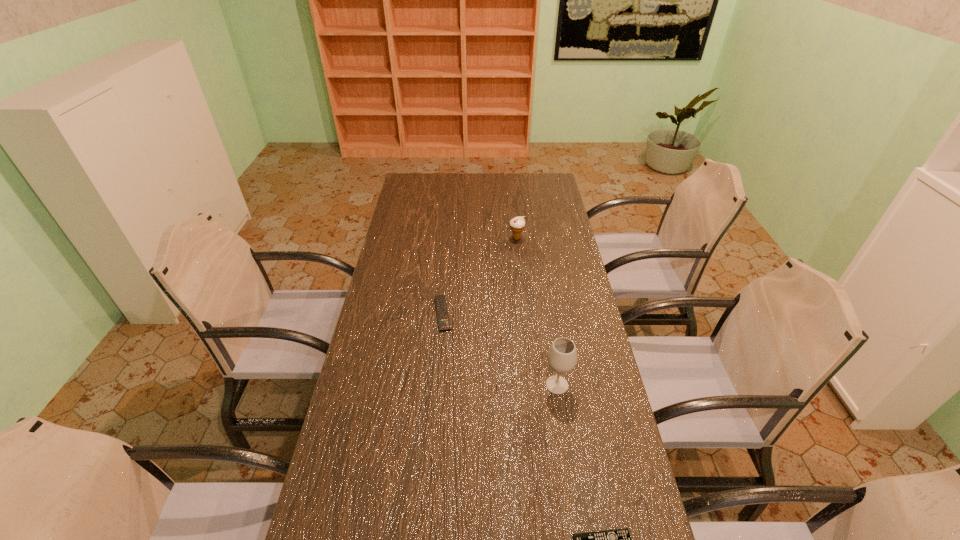
I want to click on vacant space at the far edge of the desktop, so click(x=443, y=190).

Where is `free space at the left edge`? free space at the left edge is located at coordinates (379, 430).

Image resolution: width=960 pixels, height=540 pixels. Identify the location of blank space at the right edge of the desktop. (546, 238).

I want to click on vacant region at the far right corner of the desktop, so click(550, 186).

Locate an element on the screen. The width and height of the screenshot is (960, 540). free space that is in between the farthest object and the farther remote control is located at coordinates (480, 276).

This screenshot has width=960, height=540. In order to click on vacant space that's between the second nearest object and the left remote control in this screenshot , I will do `click(500, 349)`.

Locate an element on the screen. The height and width of the screenshot is (540, 960). free space between the wineglass and the icecream is located at coordinates (537, 312).

You are a GUI agent. You are given a task and a screenshot of the screen. Output one action in this format:
    pyautogui.click(x=<x>, y=<y>)
    Task: Click on the vacant area that lies between the second tallest object and the third farthest object
    
    Given the screenshot: What is the action you would take?
    pyautogui.click(x=537, y=312)

The width and height of the screenshot is (960, 540). Find the location of `free spot between the third nearest object and the third shortest object`. free spot between the third nearest object and the third shortest object is located at coordinates (480, 276).

At what (x,y) coordinates should I click in order to perform the action: click on object that is the third closest one to the second farthest object. Please return your answer as a coordinate pair (x, y). The image size is (960, 540). Looking at the image, I should click on (619, 539).